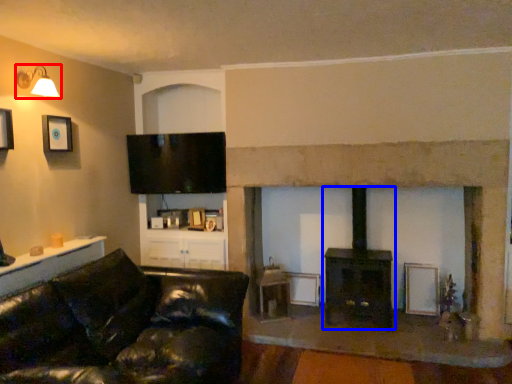
Question: Which of the following is the closest to the observer, lamp (highlighted by a red box) or wood burning stove (highlighted by a blue box)?

Choices:
 (A) lamp
 (B) wood burning stove

Answer: (A)